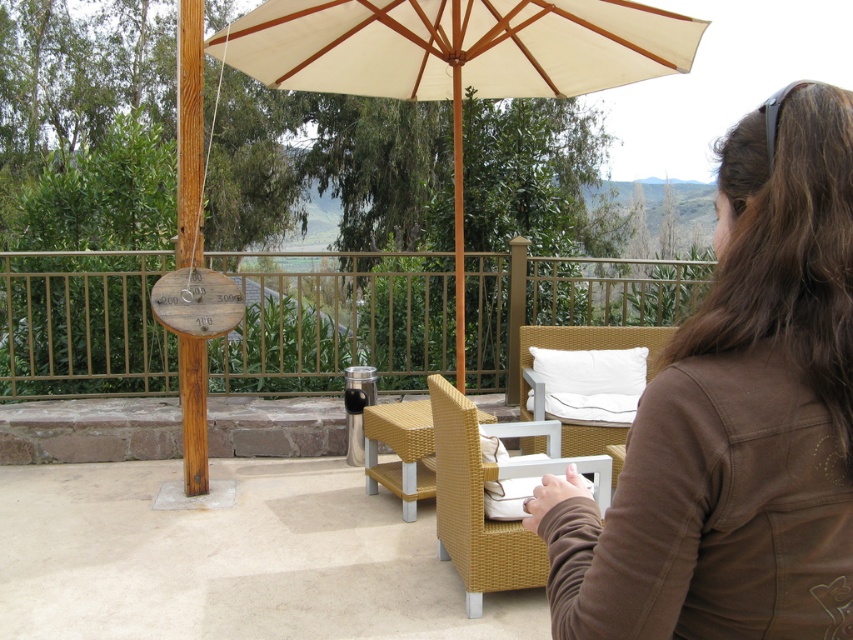
Question: Which is nearer to the white fabric umbrella at center?

Choices:
 (A) brown cotton jacket at upper right
 (B) woven wicker chair at center
 (C) white wicker chair at center
 (D) woven rattan chair at center

Answer: (D)

Question: Is white wicker chair at center closer to camera compared to woven rattan chair at center?

Choices:
 (A) no
 (B) yes

Answer: (A)

Question: Is white wicker chair at center further to camera compared to woven rattan chair at center?

Choices:
 (A) yes
 (B) no

Answer: (A)

Question: Is brown cotton jacket at upper right to the right of white wicker chair at center from the viewer's perspective?

Choices:
 (A) yes
 (B) no

Answer: (B)

Question: Which point is farther to the camera?

Choices:
 (A) (488, 548)
 (B) (541, 442)

Answer: (B)

Question: Which object is closer to the camera taking this photo?

Choices:
 (A) woven rattan chair at center
 (B) brown cotton jacket at upper right
 (C) white fabric umbrella at center
 (D) woven wicker chair at center

Answer: (B)